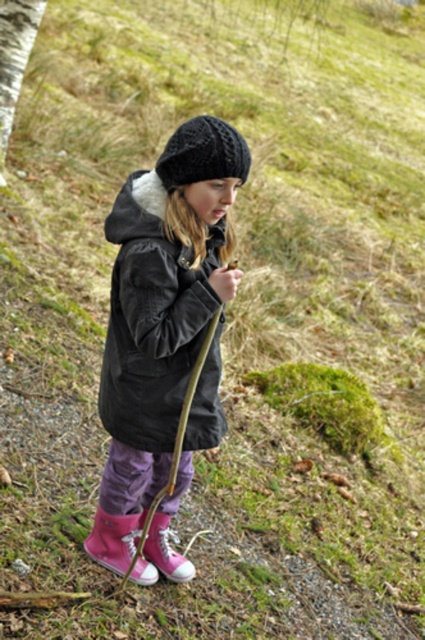
Question: Estimate the real-world distances between objects in this image. Which object is farther from the matte black jacket at center?

Choices:
 (A) black knitted hat at upper center
 (B) pink suede boot at lower center
 (C) bark-like textured tree trunk at left
 (D) pink suede boot at lower left

Answer: (C)

Question: Estimate the real-world distances between objects in this image. Which object is closer to the bark-like textured tree trunk at left?

Choices:
 (A) pink suede boot at lower center
 (B) matte black jacket at center

Answer: (B)

Question: Does matte black jacket at center appear under black knitted hat at upper center?

Choices:
 (A) yes
 (B) no

Answer: (A)

Question: Which of the following is the closest to the observer?

Choices:
 (A) pink suede boot at lower center
 (B) pink suede boot at lower left

Answer: (B)

Question: Does matte black jacket at center have a smaller size compared to pink suede boot at lower center?

Choices:
 (A) yes
 (B) no

Answer: (B)

Question: Can you confirm if matte black jacket at center is smaller than pink suede boot at lower left?

Choices:
 (A) no
 (B) yes

Answer: (A)